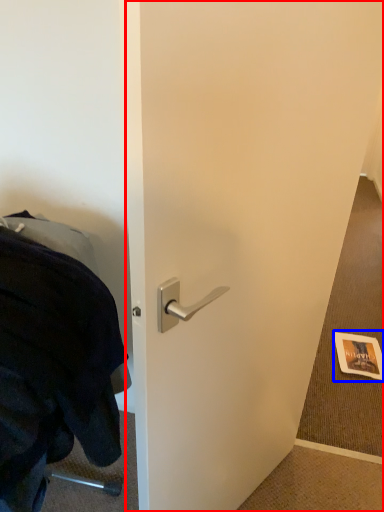
Question: Which of the following is the farthest to the observer, door (highlighted by a red box) or postcard (highlighted by a blue box)?

Choices:
 (A) door
 (B) postcard

Answer: (B)